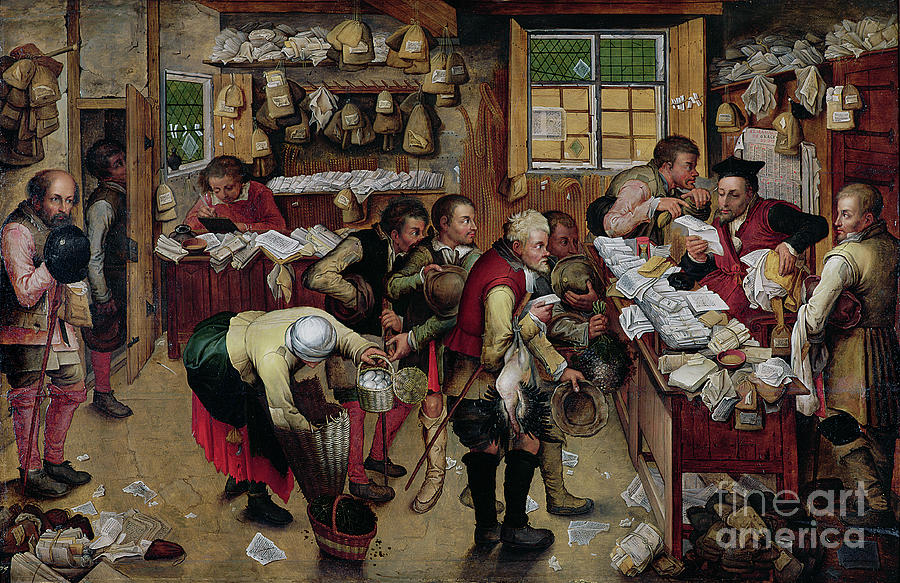
Identify the location of 1 painting. (155, 440).